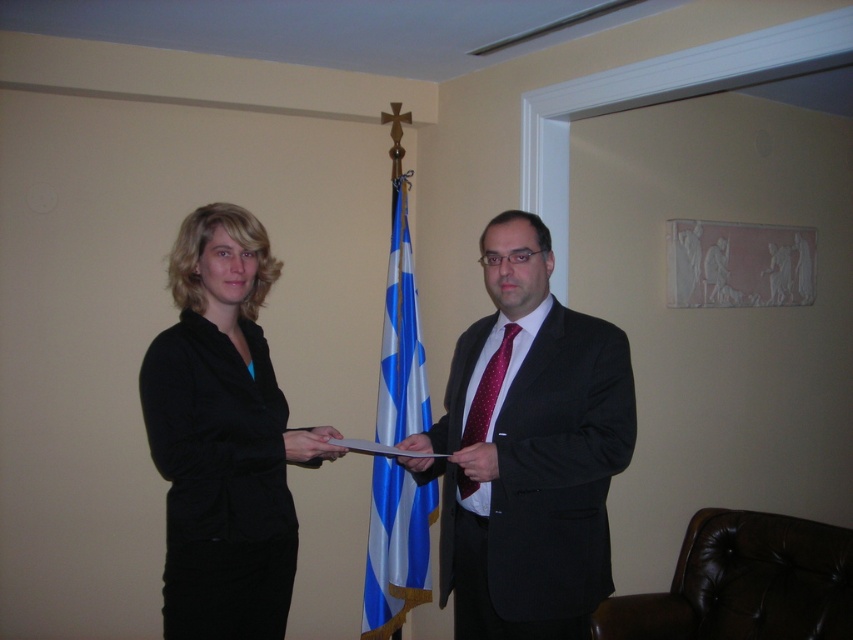
Question: Does matte black suit at center have a larger size compared to blue/white fabric flag at center?

Choices:
 (A) yes
 (B) no

Answer: (A)

Question: Is matte black suit at center to the right of matte black hand at center from the viewer's perspective?

Choices:
 (A) no
 (B) yes

Answer: (B)

Question: Estimate the real-world distances between objects in this image. Which object is closer to the smooth black hand at center?

Choices:
 (A) black matte blazer at left
 (B) red dotted fabric tie at center
 (C) matte black suit at center
 (D) matte black hand at center

Answer: (B)

Question: Which point is closer to the camera?

Choices:
 (A) (393, 474)
 (B) (289, 460)
 (C) (460, 577)
 (D) (476, 458)

Answer: (D)

Question: Is matte black hand at center thinner than smooth black hand at center?

Choices:
 (A) yes
 (B) no

Answer: (B)

Question: Which point is closer to the camera taking this photo?

Choices:
 (A) (486, 449)
 (B) (549, 428)
 (C) (312, 440)

Answer: (A)